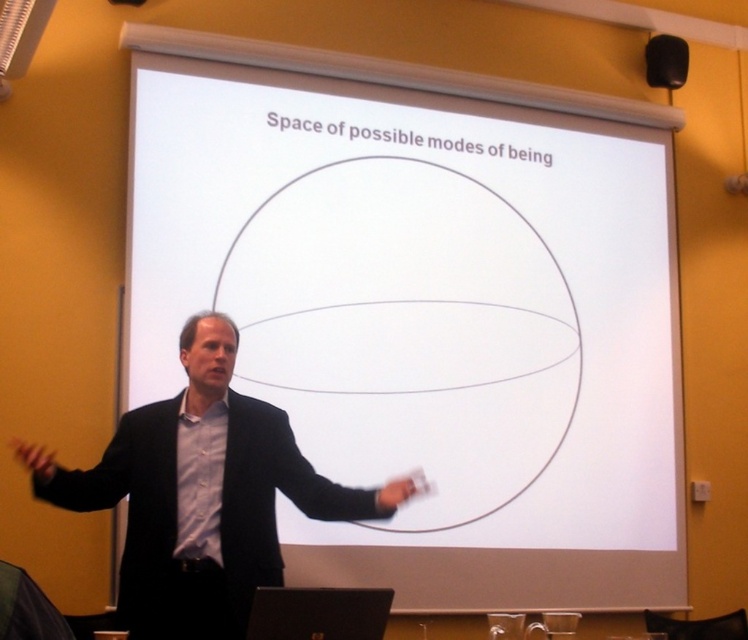
You are an attendee in the lecture hall and want to determine which of the two points on the slide is closer to you. The points are labeled as point (x=453, y=349) and point (x=687, y=54). Which one is closer?

Point (x=453, y=349) is closer to the viewer than point (x=687, y=54).

You are sitting in the front row of the classroom and want to look at both the white matte projection screen at center and the black matte speaker at upper right. Which object will appear larger to you?

The white matte projection screen at center will appear larger because it is closer to you than the black matte speaker at upper right.

You are an attendee in the classroom. You want to get the attention of the black matte speaker at upper right. Which direction should you move relative to the black matte suit at left?

Move to the right side of the black matte suit at left to face the black matte speaker at upper right since the black matte suit at left is to the left of the black matte speaker at upper right.